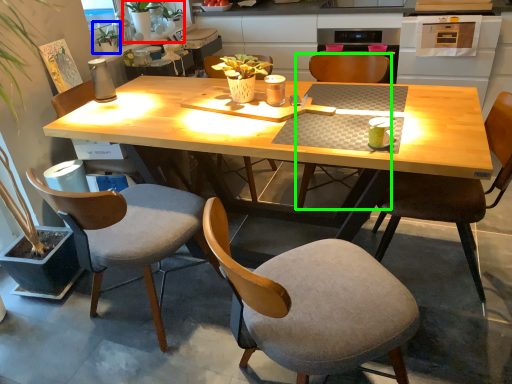
Question: Considering the real-world distances, which object is closest to houseplant (highlighted by a red box)? houseplant (highlighted by a blue box) or chair (highlighted by a green box).

Choices:
 (A) houseplant
 (B) chair

Answer: (A)